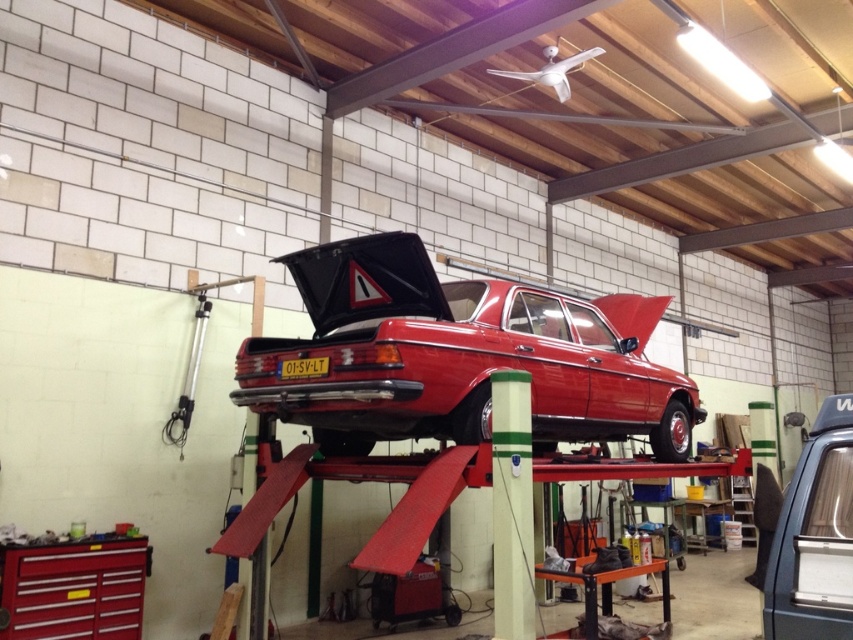
Which of these two, glossy red car at center or metallic gray car at center, stands shorter?

With less height is metallic gray car at center.

You are a GUI agent. You are given a task and a screenshot of the screen. Output one action in this format:
    pyautogui.click(x=<x>, y=<y>)
    Task: Click on the glossy red car at center
    
    Given the screenshot: What is the action you would take?
    pyautogui.click(x=454, y=356)

This screenshot has height=640, width=853. Describe the element at coordinates (454, 356) in the screenshot. I see `glossy red car at center` at that location.

The image size is (853, 640). In order to click on glossy red car at center in this screenshot , I will do `click(454, 356)`.